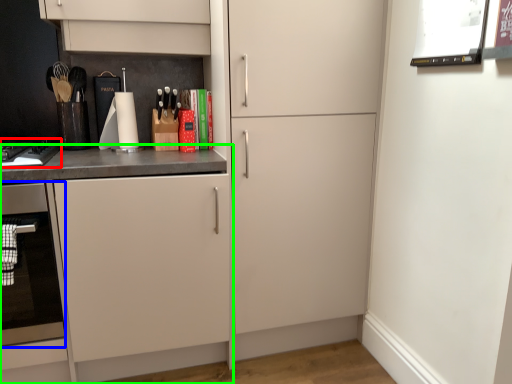
Question: Estimate the real-world distances between objects in this image. Which object is farther from home appliance (highlighted by a red box), oven (highlighted by a blue box) or cabinetry (highlighted by a green box)?

Choices:
 (A) oven
 (B) cabinetry

Answer: (A)